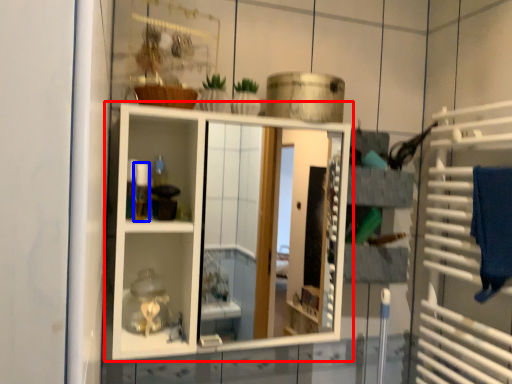
Question: Which object appears closest to the camera in this image, shelf (highlighted by a red box) or toiletry (highlighted by a blue box)?

Choices:
 (A) shelf
 (B) toiletry

Answer: (A)